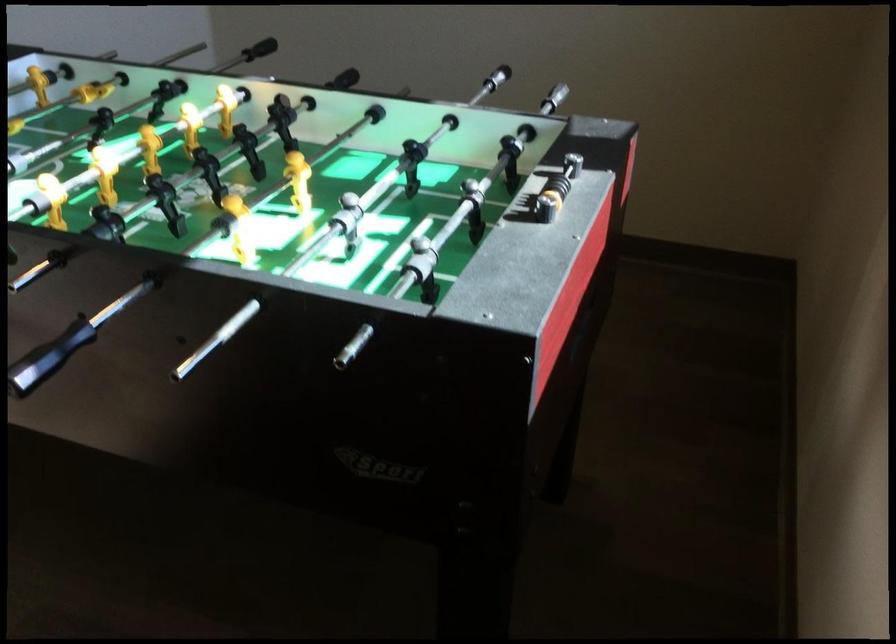
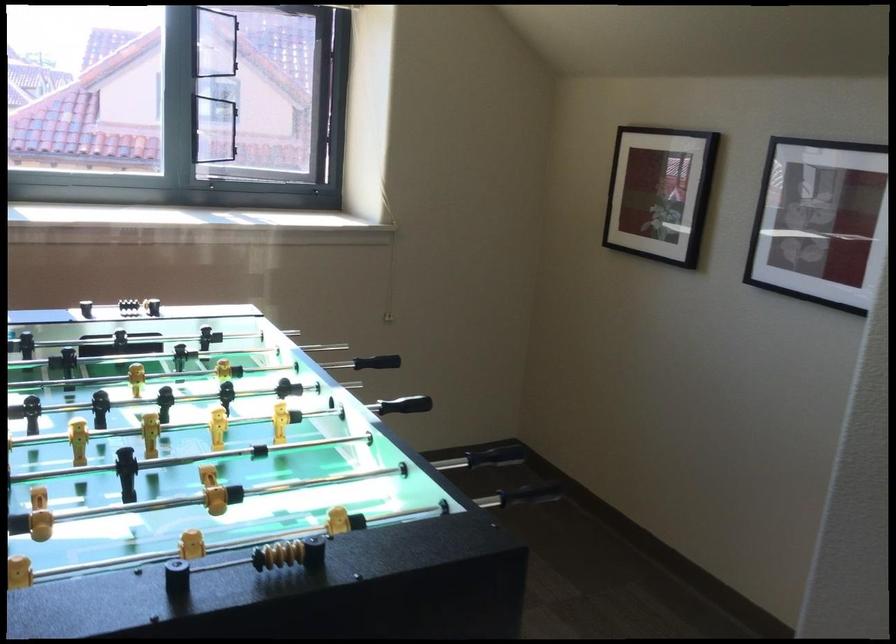
Find the pixel in the second image that matches pixel 48 357 in the first image.

(376, 368)